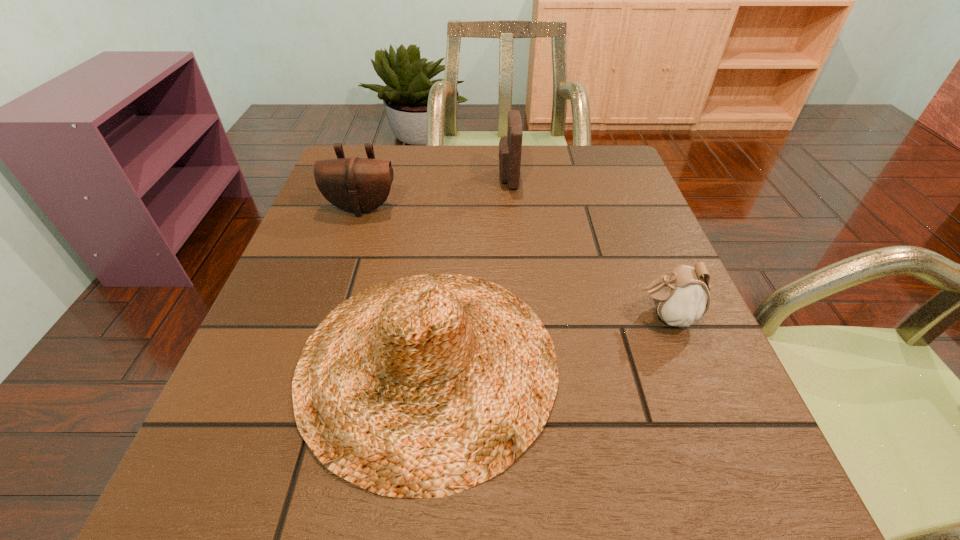
Image resolution: width=960 pixels, height=540 pixels. Identify the location of free space between the rightmost pouch and the second farthest object. (514, 262).

Locate an element on the screen. free spot between the second pouch from right to left and the sunhat is located at coordinates (468, 271).

Where is `free space between the leftmost pouch and the shortest pouch`? This screenshot has width=960, height=540. free space between the leftmost pouch and the shortest pouch is located at coordinates (514, 262).

What are the coordinates of `vacant area that lies between the second farthest object and the farthest pouch` in the screenshot? It's located at (435, 193).

The width and height of the screenshot is (960, 540). Find the location of `free area in between the farthest pouch and the shortest pouch`. free area in between the farthest pouch and the shortest pouch is located at coordinates (587, 247).

Find the location of `vacant area between the leftmost pouch and the shortest pouch`. vacant area between the leftmost pouch and the shortest pouch is located at coordinates (514, 262).

At what (x,y) coordinates should I click in order to perform the action: click on unoccupied area between the farthest pouch and the sunhat. Please return your answer as a coordinate pair (x, y). The height and width of the screenshot is (540, 960). Looking at the image, I should click on (468, 271).

Choose which object is the nearest neighbor to the second nearest pouch. Please provide its 2D coordinates. Your answer should be formatted as a tuple, i.e. [(x, y)], where the tuple contains the x and y coordinates of a point satisfying the conditions above.

[(421, 387)]

Select which object is the third closest to the rightmost object. Please provide its 2D coordinates. Your answer should be formatted as a tuple, i.e. [(x, y)], where the tuple contains the x and y coordinates of a point satisfying the conditions above.

[(358, 185)]

What are the coordinates of `pouch that stands as the second closest to the second farthest object` in the screenshot? It's located at (681, 297).